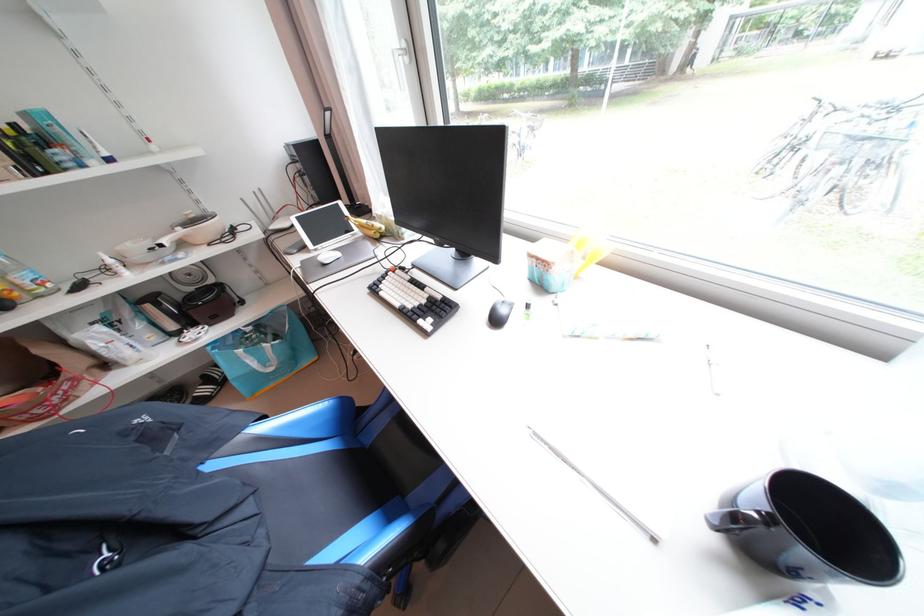
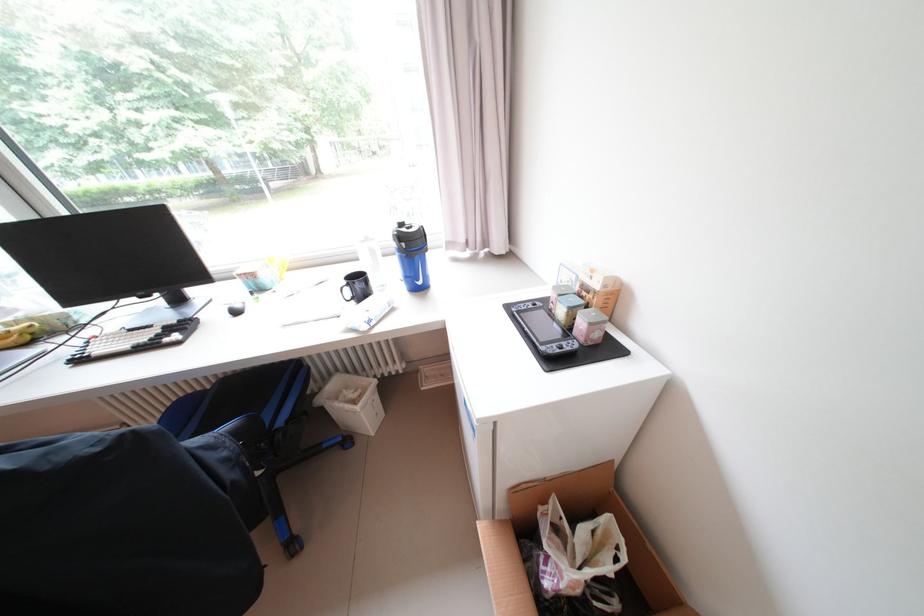
Question: How did the camera likely rotate?

Choices:
 (A) Left
 (B) Right
 (C) Up
 (D) Down

Answer: (B)